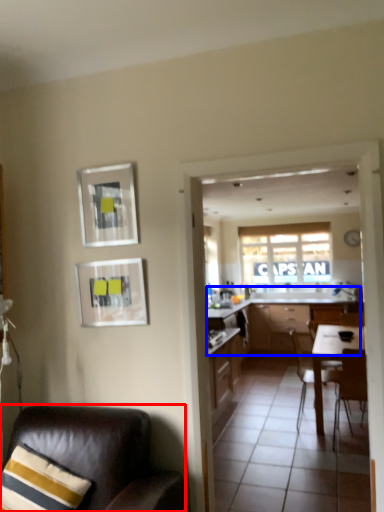
Question: Which object is further to the camera taking this photo, chair (highlighted by a red box) or cabinetry (highlighted by a blue box)?

Choices:
 (A) chair
 (B) cabinetry

Answer: (B)